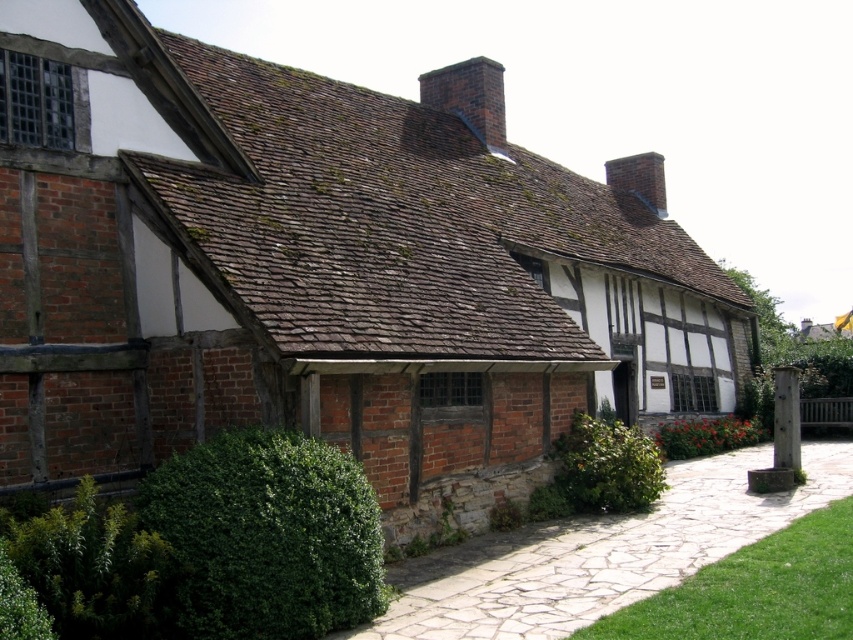
Question: Which object appears farthest from the camera in this image?

Choices:
 (A) green leafy hedge at lower left
 (B) dark green leafy hedge at lower left
 (C) green leafy hedge at center
 (D) brick chimney at upper center

Answer: (D)

Question: Is the position of green leafy hedge at lower left more distant than that of green leafy hedge at center?

Choices:
 (A) yes
 (B) no

Answer: (B)

Question: Which point is closer to the camera?

Choices:
 (A) (465, 64)
 (B) (641, 502)

Answer: (B)

Question: Estimate the real-world distances between objects in this image. Which object is farther from the brick chimney at upper center?

Choices:
 (A) green leafy hedge at lower left
 (B) green leafy hedge at center

Answer: (A)

Question: Does dark green leafy hedge at lower left appear on the left side of brick chimney at upper center?

Choices:
 (A) yes
 (B) no

Answer: (A)

Question: In this image, where is dark green leafy hedge at lower left located relative to green leafy hedge at center?

Choices:
 (A) left
 (B) right

Answer: (A)